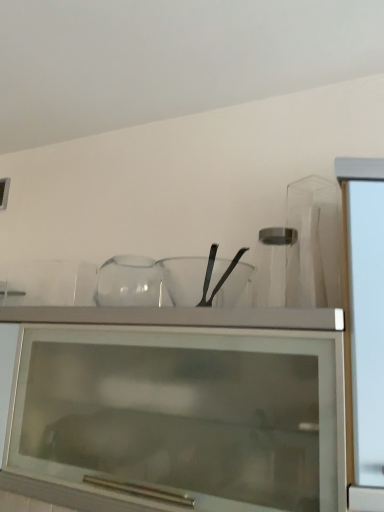
Question: Should I look upward or downward to see transparent glass mixing bowl at center?

Choices:
 (A) up
 (B) down

Answer: (B)

Question: Can you confirm if transparent glass jar at center is taller than transparent glass mixing bowl at center?

Choices:
 (A) no
 (B) yes

Answer: (B)

Question: Is transparent glass jar at center far from transparent glass mixing bowl at center?

Choices:
 (A) yes
 (B) no

Answer: (B)

Question: Could you tell me if transparent glass jar at center is turned towards transparent glass mixing bowl at center?

Choices:
 (A) yes
 (B) no

Answer: (B)

Question: Is transparent glass jar at center to the left of transparent glass mixing bowl at center from the viewer's perspective?

Choices:
 (A) no
 (B) yes

Answer: (A)

Question: Considering the relative positions of transparent glass jar at center and transparent glass mixing bowl at center in the image provided, is transparent glass jar at center in front of transparent glass mixing bowl at center?

Choices:
 (A) no
 (B) yes

Answer: (B)

Question: From a real-world perspective, is transparent glass jar at center located beneath transparent glass mixing bowl at center?

Choices:
 (A) no
 (B) yes

Answer: (A)

Question: Considering the relative positions of transparent glass jar at center and transparent glass cabinet at upper center in the image provided, is transparent glass jar at center behind transparent glass cabinet at upper center?

Choices:
 (A) yes
 (B) no

Answer: (A)

Question: Is transparent glass jar at center aimed at transparent glass cabinet at upper center?

Choices:
 (A) yes
 (B) no

Answer: (B)

Question: Is transparent glass jar at center not inside transparent glass cabinet at upper center?

Choices:
 (A) yes
 (B) no

Answer: (A)

Question: From a real-world perspective, is transparent glass jar at center on transparent glass cabinet at upper center?

Choices:
 (A) no
 (B) yes

Answer: (B)

Question: Does transparent glass jar at center appear on the right side of transparent glass cabinet at upper center?

Choices:
 (A) yes
 (B) no

Answer: (A)

Question: Considering the relative sizes of transparent glass jar at center and transparent glass cabinet at upper center in the image provided, is transparent glass jar at center thinner than transparent glass cabinet at upper center?

Choices:
 (A) no
 (B) yes

Answer: (B)

Question: Is transparent glass mixing bowl at center completely or partially inside transparent glass cabinet at upper center?

Choices:
 (A) no
 (B) yes

Answer: (A)